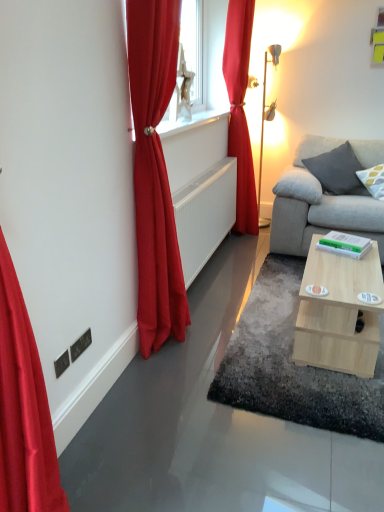
Identify the location of vacant area that lies in front of satin red curtain at left, which ranks as the second curtain in back-to-front order. This screenshot has width=384, height=512. (175, 375).